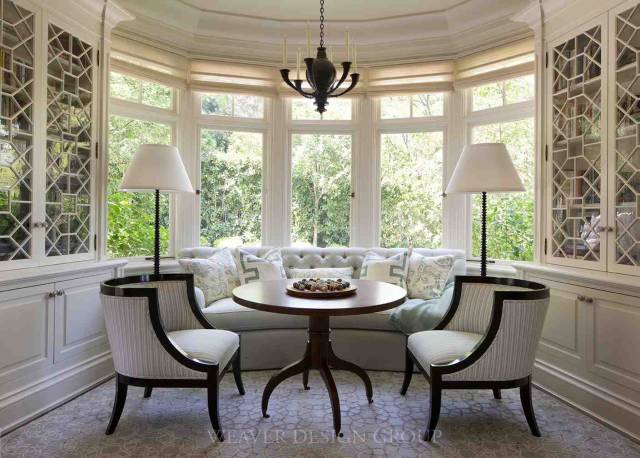
You are a GUI agent. You are given a task and a screenshot of the screen. Output one action in this format:
    pyautogui.click(x=<x>, y=<y>)
    Task: Click on the table
    This screenshot has height=458, width=640.
    Given the screenshot: What is the action you would take?
    pyautogui.click(x=281, y=307)